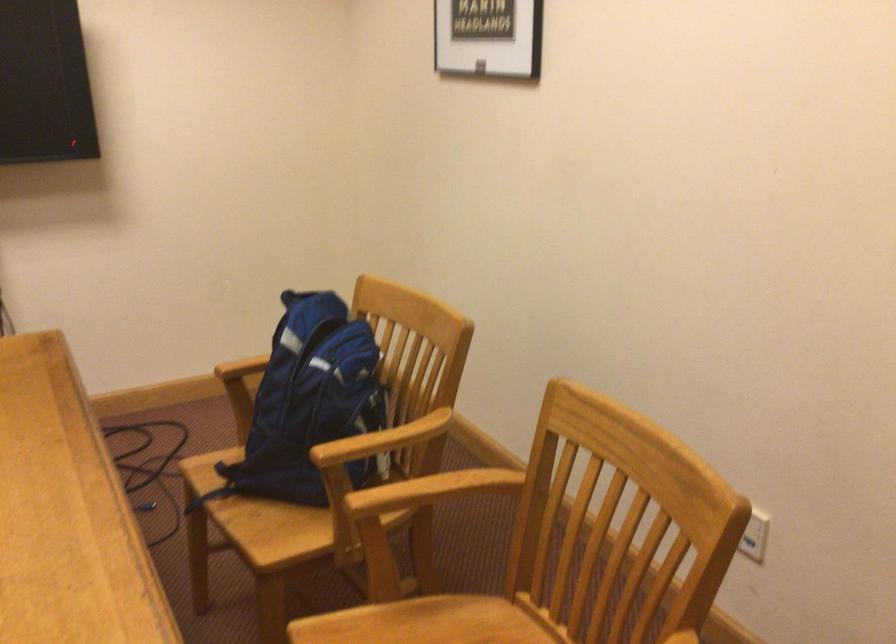
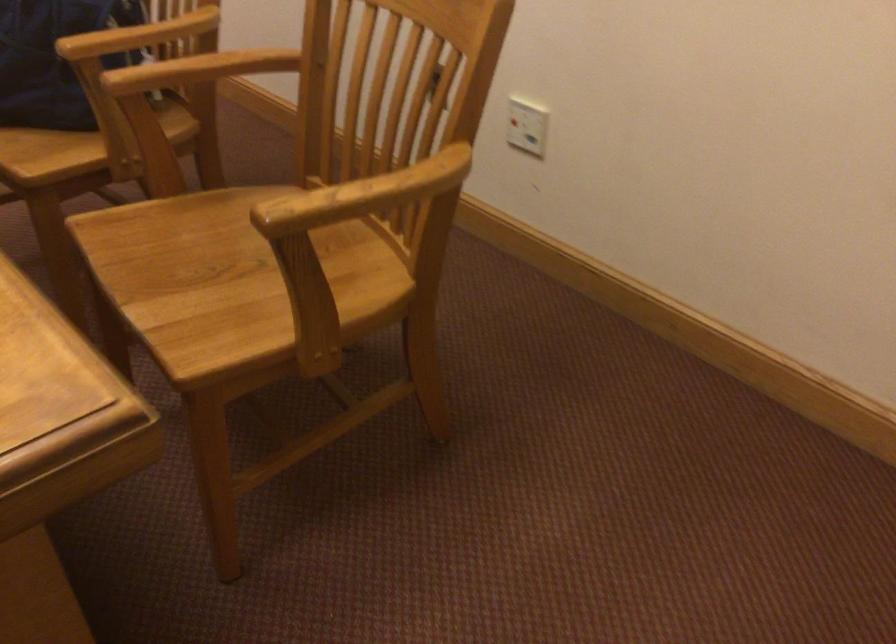
Question: How did the camera likely rotate?

Choices:
 (A) Left
 (B) Right
 (C) Up
 (D) Down

Answer: (D)